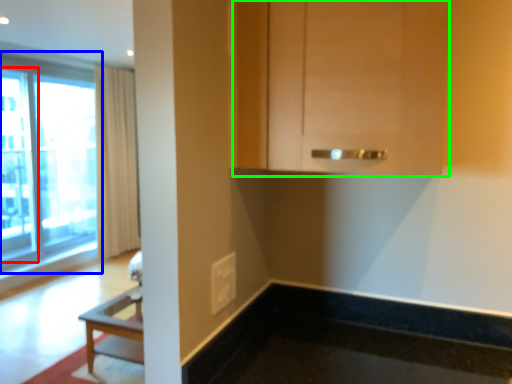
Question: Considering the real-world distances, which object is farthest from screen door (highlighted by a red box)? window (highlighted by a blue box) or cabinetry (highlighted by a green box)?

Choices:
 (A) window
 (B) cabinetry

Answer: (B)